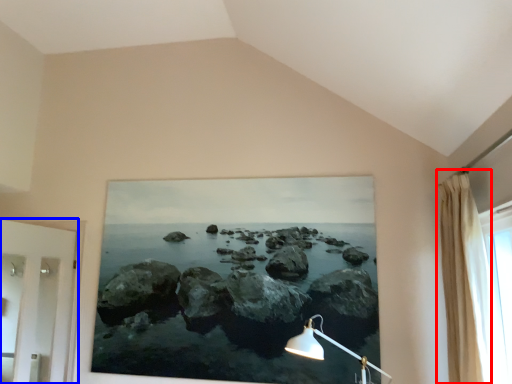
Question: Among these objects, which one is nearest to the camera, curtain (highlighted by a red box) or door (highlighted by a blue box)?

Choices:
 (A) curtain
 (B) door

Answer: (A)